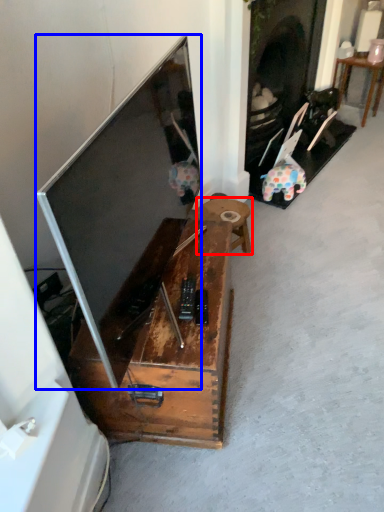
Question: Which of the following is the farthest to the observer, table (highlighted by a red box) or television (highlighted by a blue box)?

Choices:
 (A) table
 (B) television

Answer: (A)